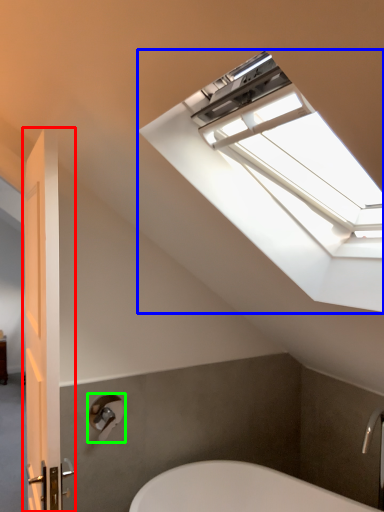
Question: Estimate the real-world distances between objects in this image. Which object is farther from door (highlighted by a red box), window (highlighted by a blue box) or shower (highlighted by a green box)?

Choices:
 (A) window
 (B) shower

Answer: (B)